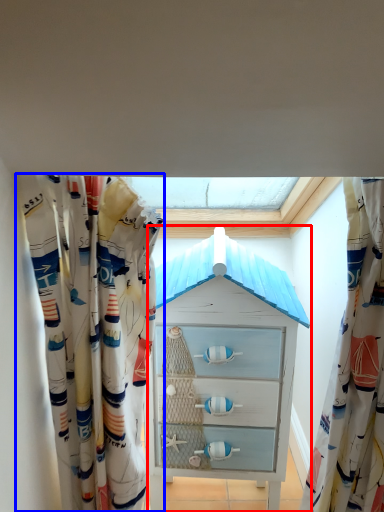
Question: Among these objects, which one is nearest to the camera, chest of drawers (highlighted by a red box) or curtain (highlighted by a blue box)?

Choices:
 (A) chest of drawers
 (B) curtain

Answer: (B)